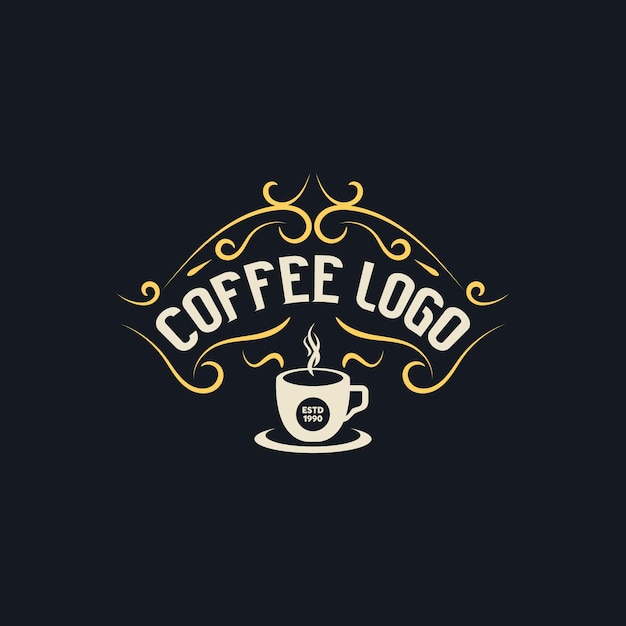
Image resolution: width=626 pixels, height=626 pixels. What are the coordinates of `black circle on cup side  with white lighting` in the screenshot? It's located at (313, 412).